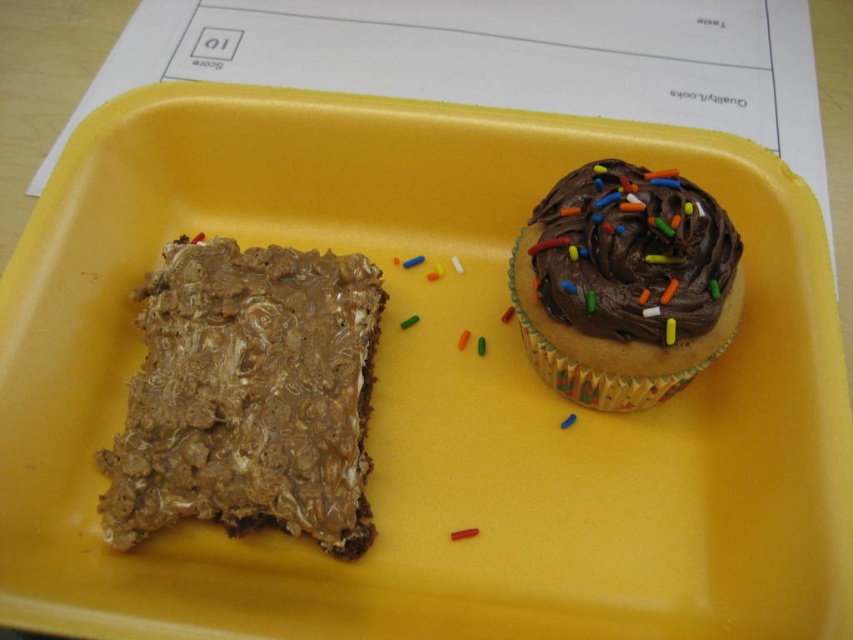
Does point (361, 275) come behind point (625, 204)?

Yes, point (361, 275) is farther from viewer.

Looking at this image, measure the distance from chocolatecrumblycake at left to chocolate frosted cupcake at upper right.

chocolatecrumblycake at left is 39.30 centimeters from chocolate frosted cupcake at upper right.

Does point (186, 472) come behind point (650, 280)?

No.

This screenshot has height=640, width=853. In order to click on chocolatecrumblycake at left in this screenshot , I will do `click(248, 396)`.